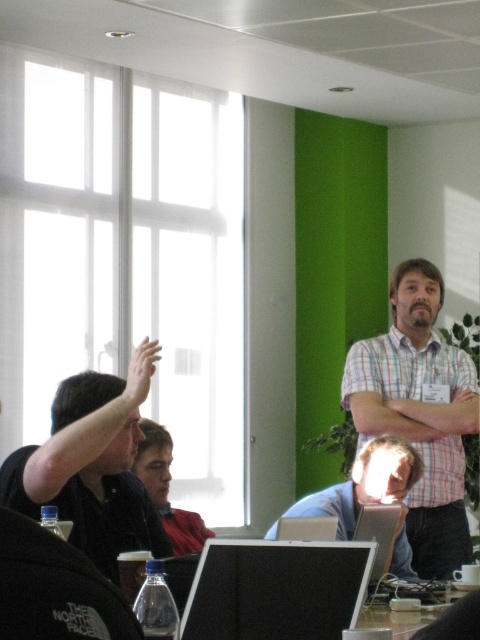
You are organizing a group photo and need to arrange the participants from the narrowest to widest based on their clothing. Given the black matte shirt at left and plaid fabric shirt at upper right, which order should they be placed in?

The black matte shirt at left should come first since it is narrower than the plaid fabric shirt at upper right, which is wider.

You are organizing a photo shoot and need to ensure that all participants are visible in the frame. Given that the black matte shirt at left and the plaid fabric shirt at upper right are the main subjects, which one might require more space in the composition due to its size?

The black matte shirt at left is bigger than the plaid fabric shirt at upper right, so it would require more space in the composition to ensure visibility.